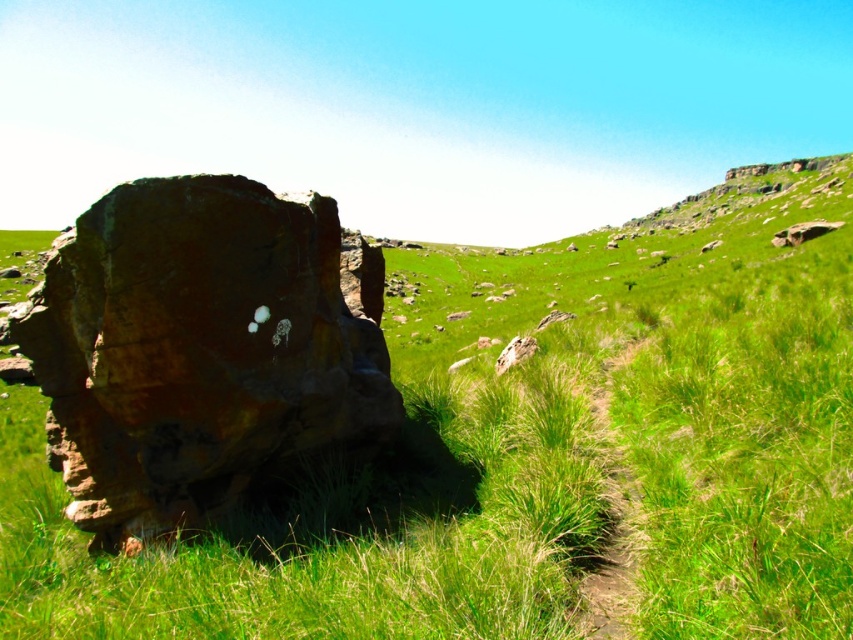
You are planning to set up a picnic area in the scene. Which area would be better for a larger picnic blanket, the green grassy at left or the green grassy hillside at upper center?

The green grassy hillside at upper center would be better for a larger picnic blanket because it occupies more space than the green grassy at left.

You are planning to walk from the smooth brown rock at upper right to the brown dirt path at center. Which direction should you head to reach the path?

To reach the brown dirt path at center from the smooth brown rock at upper right, you should head towards the center of the image since the path is larger in size and located centrally.